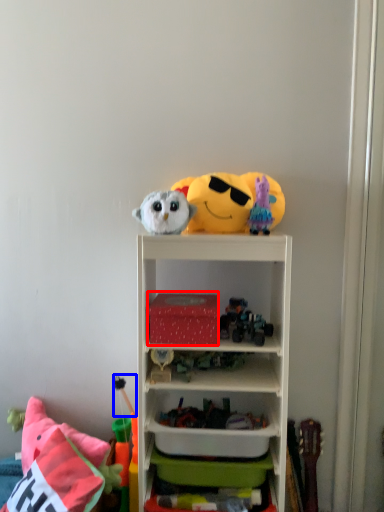
Question: Which of the following is the farthest to the observer, storage box (highlighted by a red box) or toy (highlighted by a blue box)?

Choices:
 (A) storage box
 (B) toy

Answer: (B)